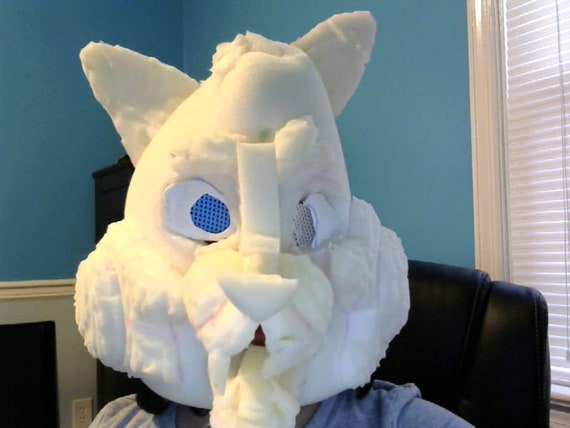
Locate an element on the screen. The image size is (570, 428). molding is located at coordinates (486, 160), (559, 417).